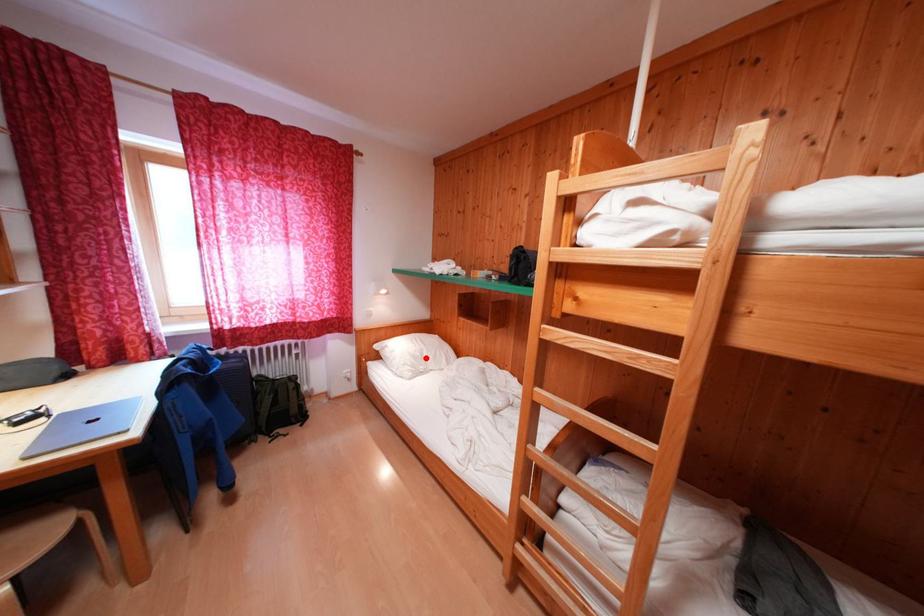
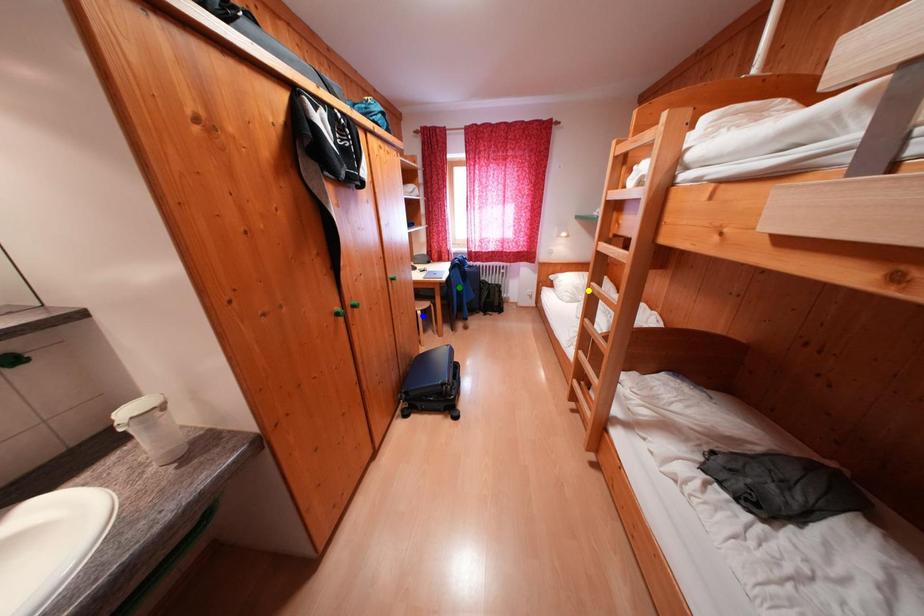
Question: I am providing you with two images of the same scene from different viewpoints. A red point is marked on the first image. You are given multiple points on the second image. Which point in image 2 represents the same 3d spot as the red point in image 1?

Choices:
 (A) blue point
 (B) green point
 (C) yellow point

Answer: (C)